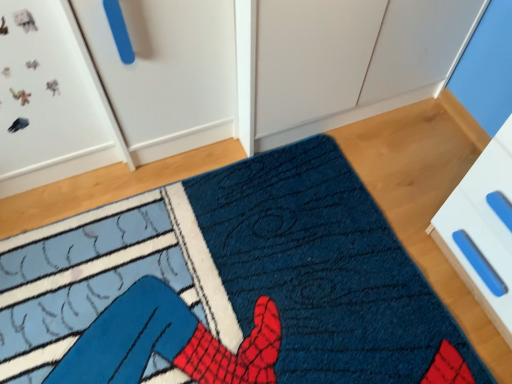
The image size is (512, 384). In order to click on vacant space behind white plastic drawer at lower right in this screenshot , I will do pos(422,166).